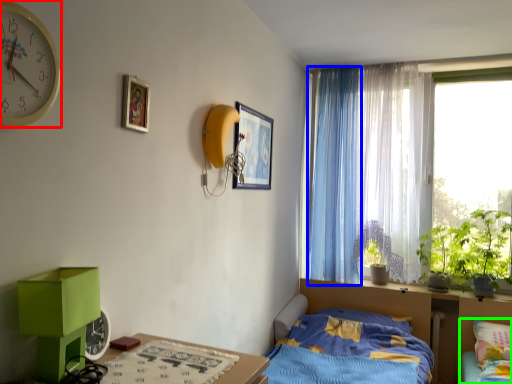
Question: Which object is positioned closest to clock (highlighted by a red box)? Select from curtain (highlighted by a blue box) and bed (highlighted by a green box).

Choices:
 (A) curtain
 (B) bed

Answer: (A)